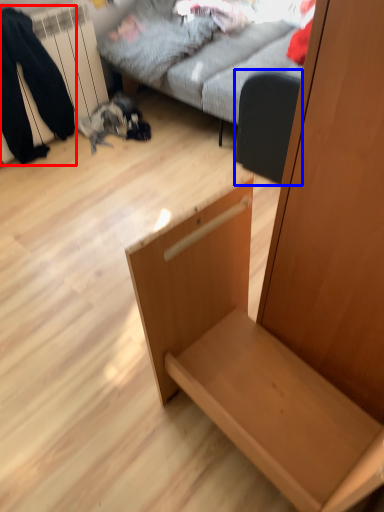
Question: Among these objects, which one is farthest to the camera, couple (highlighted by a red box) or swivel chair (highlighted by a blue box)?

Choices:
 (A) couple
 (B) swivel chair

Answer: (B)